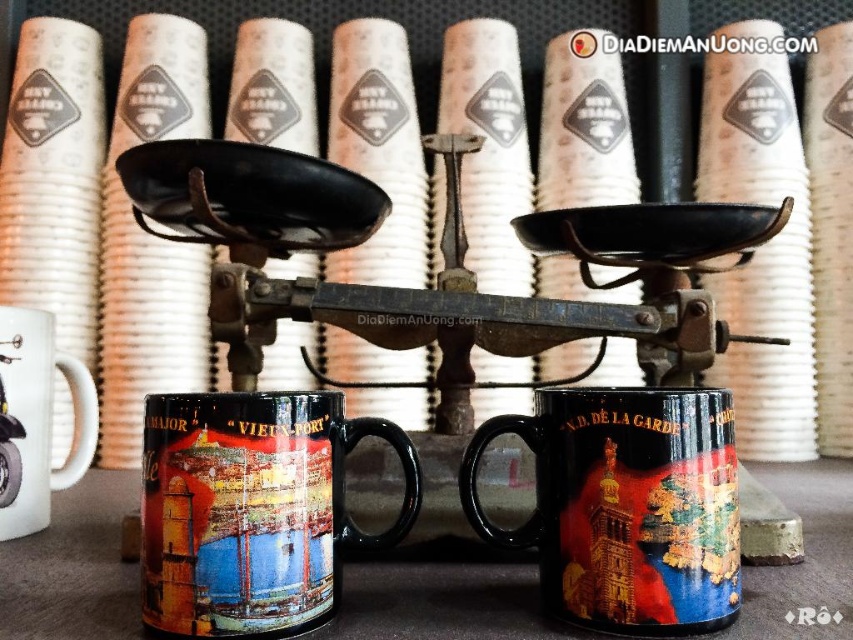
Between point (201, 604) and point (537, 493), which one is positioned in front?

Positioned in front is point (201, 604).

Can you confirm if glossy ceramic mug at center is positioned to the left of black ceramic mug at center?

Indeed, glossy ceramic mug at center is positioned on the left side of black ceramic mug at center.

Does point (265, 596) lie in front of point (550, 502)?

Yes, point (265, 596) is in front of point (550, 502).

This screenshot has width=853, height=640. Find the location of `glossy ceramic mug at center`. glossy ceramic mug at center is located at coordinates (252, 509).

I want to click on glossy ceramic mug at center, so click(252, 509).

Is glossy ceramic mug at center bigger than white glossy mug at left?

Correct, glossy ceramic mug at center is larger in size than white glossy mug at left.

Which is behind, point (178, 406) or point (6, 387)?

The point (6, 387) is more distant.

The width and height of the screenshot is (853, 640). Find the location of `glossy ceramic mug at center`. glossy ceramic mug at center is located at coordinates (252, 509).

Can you confirm if black ceramic mug at center is positioned below white glossy mug at left?

Indeed, black ceramic mug at center is positioned under white glossy mug at left.

Which of these two, black ceramic mug at center or white glossy mug at left, stands taller?

white glossy mug at left

Find the location of `black ceramic mug at center`. black ceramic mug at center is located at coordinates 625,506.